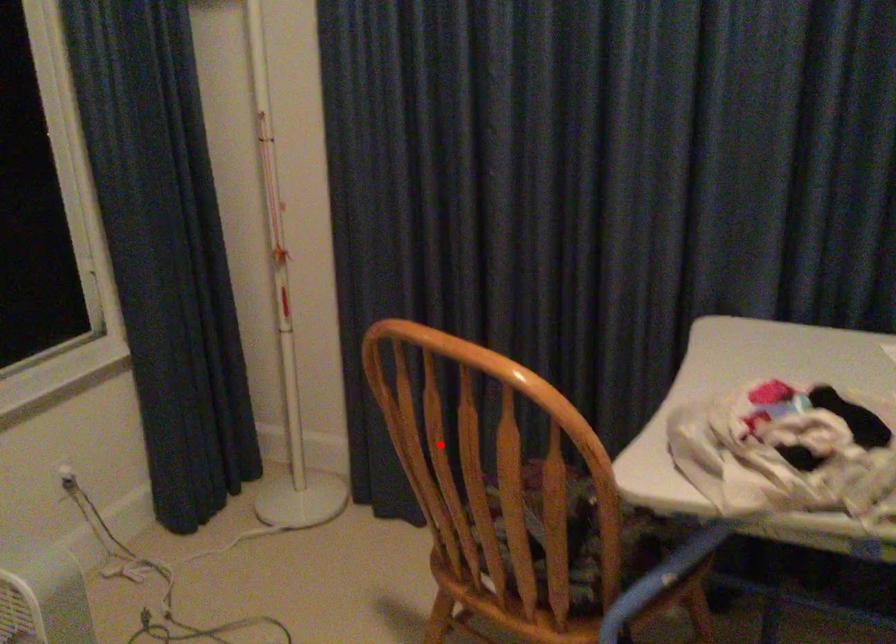
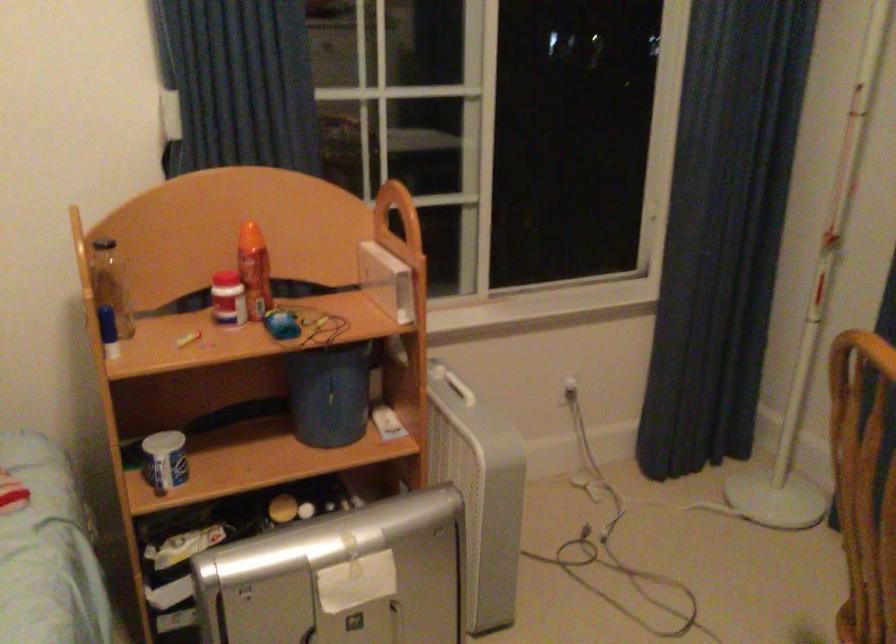
Question: A red point is marked in image1. In image2, is the corresponding 3D point closer to the camera or farther? Reply with the corresponding letter.

Choices:
 (A) The corresponding 3D point is closer.
 (B) The corresponding 3D point is farther.

Answer: (A)